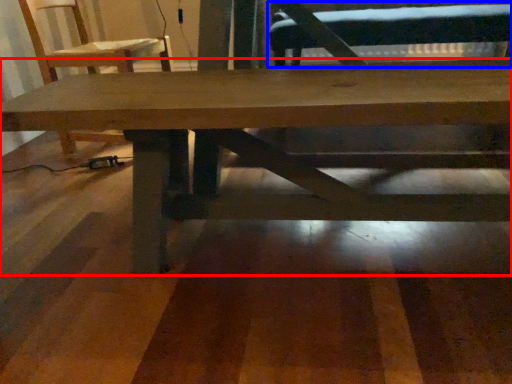
Question: Which object appears farthest to the camera in this image, table (highlighted by a red box) or swivel chair (highlighted by a blue box)?

Choices:
 (A) table
 (B) swivel chair

Answer: (B)